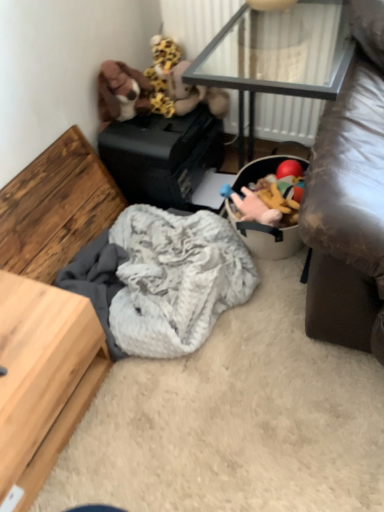
Question: In which direction should I rotate to look at fuzzy fabric stuffed animal at upper center, which appears as the 3th toy when viewed from the left?

Choices:
 (A) right
 (B) left

Answer: (A)

Question: Does fuzzy gray blanket at center have a smaller size compared to fluffy yellow and brown stuffed animal at upper center, the second toy when ordered from left to right?

Choices:
 (A) yes
 (B) no

Answer: (B)

Question: Could you tell me if fuzzy gray blanket at center is facing fluffy yellow and brown stuffed animal at upper center, the fourth toy viewed from the right?

Choices:
 (A) yes
 (B) no

Answer: (B)

Question: Can you confirm if fuzzy gray blanket at center is thinner than fluffy yellow and brown stuffed animal at upper center, the second toy when ordered from left to right?

Choices:
 (A) yes
 (B) no

Answer: (B)

Question: Is the depth of fuzzy gray blanket at center greater than that of fluffy yellow and brown stuffed animal at upper center, the second toy when ordered from left to right?

Choices:
 (A) yes
 (B) no

Answer: (B)

Question: Considering the relative sizes of fuzzy gray blanket at center and fluffy yellow and brown stuffed animal at upper center, the second toy when ordered from left to right, in the image provided, is fuzzy gray blanket at center wider than fluffy yellow and brown stuffed animal at upper center, the second toy when ordered from left to right,?

Choices:
 (A) no
 (B) yes

Answer: (B)

Question: Would you consider fuzzy gray blanket at center to be distant from fluffy yellow and brown stuffed animal at upper center, the second toy when ordered from left to right?

Choices:
 (A) yes
 (B) no

Answer: (B)

Question: From a real-world perspective, is fuzzy gray blanket at center located higher than transparent glass table at upper center?

Choices:
 (A) no
 (B) yes

Answer: (A)

Question: Can you confirm if fuzzy gray blanket at center is thinner than transparent glass table at upper center?

Choices:
 (A) yes
 (B) no

Answer: (B)

Question: From a real-world perspective, is fuzzy gray blanket at center physically below transparent glass table at upper center?

Choices:
 (A) no
 (B) yes

Answer: (B)

Question: Can you confirm if fuzzy gray blanket at center is smaller than transparent glass table at upper center?

Choices:
 (A) yes
 (B) no

Answer: (A)

Question: From the image's perspective, is fuzzy gray blanket at center on top of transparent glass table at upper center?

Choices:
 (A) yes
 (B) no

Answer: (B)

Question: Is fuzzy gray blanket at center positioned before transparent glass table at upper center?

Choices:
 (A) yes
 (B) no

Answer: (A)

Question: From the image's perspective, would you say transparent glass table at upper center is shown under fuzzy fabric stuffed animal at upper center, which appears as the 3th toy when viewed from the left?

Choices:
 (A) no
 (B) yes

Answer: (A)